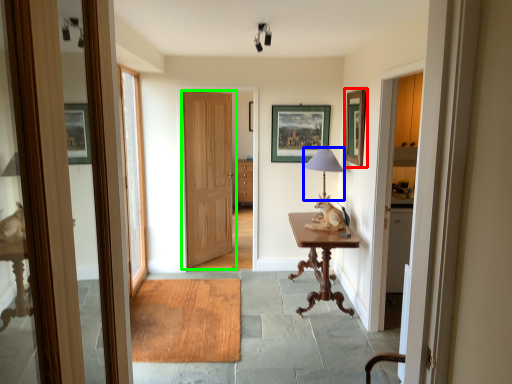
Question: Which object is positioned closest to picture frame (highlighted by a red box)? Select from table lamp (highlighted by a blue box) and door (highlighted by a green box).

Choices:
 (A) table lamp
 (B) door

Answer: (A)